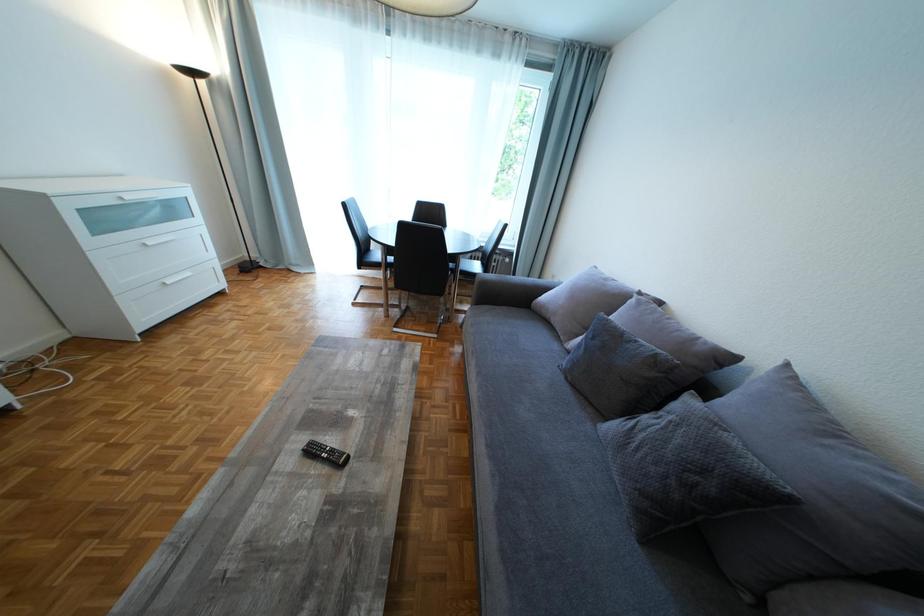
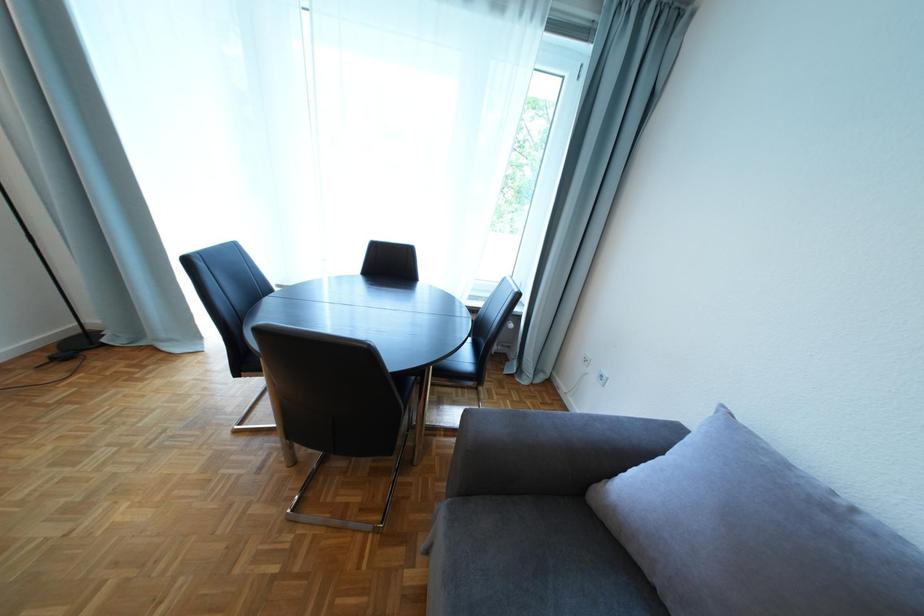
Question: What movement of the cameraman would produce the second image?

Choices:
 (A) Left
 (B) Right
 (C) Forward
 (D) Backward

Answer: (C)